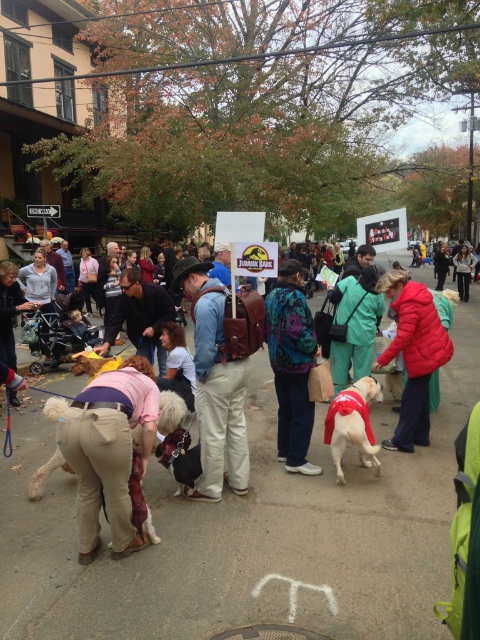
Question: Can you confirm if beige pants at center is positioned to the right of teal patterned sweater at center?

Choices:
 (A) no
 (B) yes

Answer: (A)

Question: Observing the image, what is the correct spatial positioning of shiny red fabric dog at center in reference to fluffy beige dog at center?

Choices:
 (A) left
 (B) right

Answer: (B)

Question: Observing the image, what is the correct spatial positioning of shiny red fabric dog at center in reference to fluffy beige dog at center?

Choices:
 (A) below
 (B) above

Answer: (B)

Question: Which point is farther to the camera?

Choices:
 (A) (340, 445)
 (B) (272, 358)

Answer: (B)

Question: Among these points, which one is farthest from the camera?

Choices:
 (A) (60, 406)
 (B) (83, 536)

Answer: (A)

Question: Which point appears closest to the camera in this image?

Choices:
 (A) click(x=430, y=301)
 (B) click(x=159, y=344)
 (C) click(x=216, y=433)

Answer: (C)